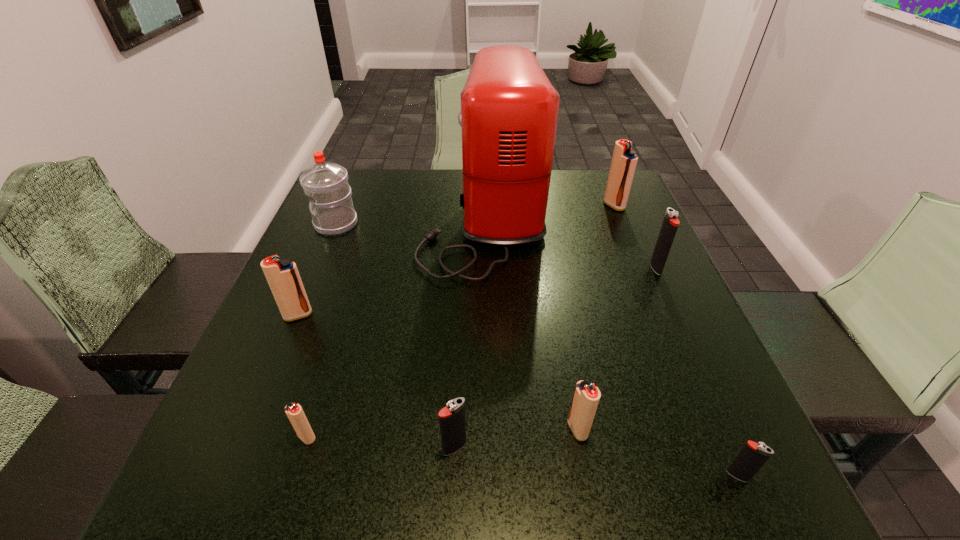
In the image, there is a desktop. Identify the location of vacant space at the near right corner. The width and height of the screenshot is (960, 540). (760, 492).

Identify the location of blank region between the second smallest black igniter and the water bottle. Image resolution: width=960 pixels, height=540 pixels. 396,336.

Find the location of `unoccupied position between the tallest object and the second igniter from left to right`. unoccupied position between the tallest object and the second igniter from left to right is located at coordinates (396, 328).

The image size is (960, 540). Identify the location of free space that is in between the white water bottle and the seventh object from right to left. (322, 330).

Where is `vacant area that lies between the nearest object and the second red igniter from right to left`? This screenshot has height=540, width=960. vacant area that lies between the nearest object and the second red igniter from right to left is located at coordinates (658, 453).

Where is `blank region between the third red igniter from right to left and the second nearest black igniter`? Image resolution: width=960 pixels, height=540 pixels. blank region between the third red igniter from right to left and the second nearest black igniter is located at coordinates (381, 442).

Identify the location of free area in between the leftmost black igniter and the tallest igniter. (535, 326).

Where is `free space between the fifth nearest igniter and the sixth igniter from right to left`? The height and width of the screenshot is (540, 960). free space between the fifth nearest igniter and the sixth igniter from right to left is located at coordinates (302, 376).

Identify the location of vacant point located between the third biggest red igniter and the smallest black igniter. This screenshot has height=540, width=960. (658, 453).

Locate an element on the screen. free space between the kitchen mixer and the third red igniter from right to left is located at coordinates (396, 328).